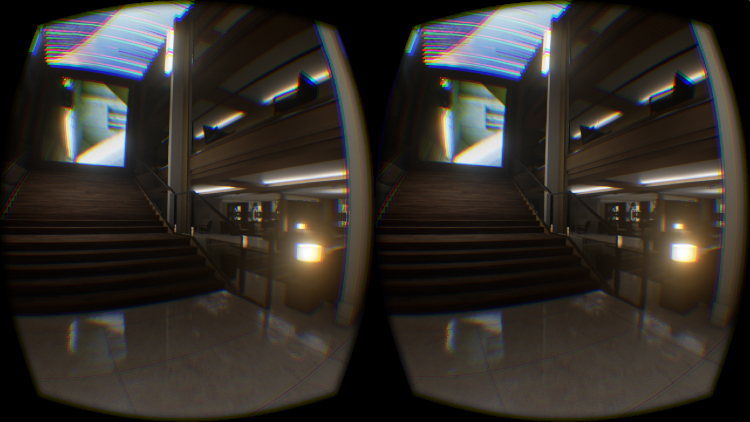
This screenshot has height=422, width=750. I want to click on ceiling, so click(x=68, y=24).